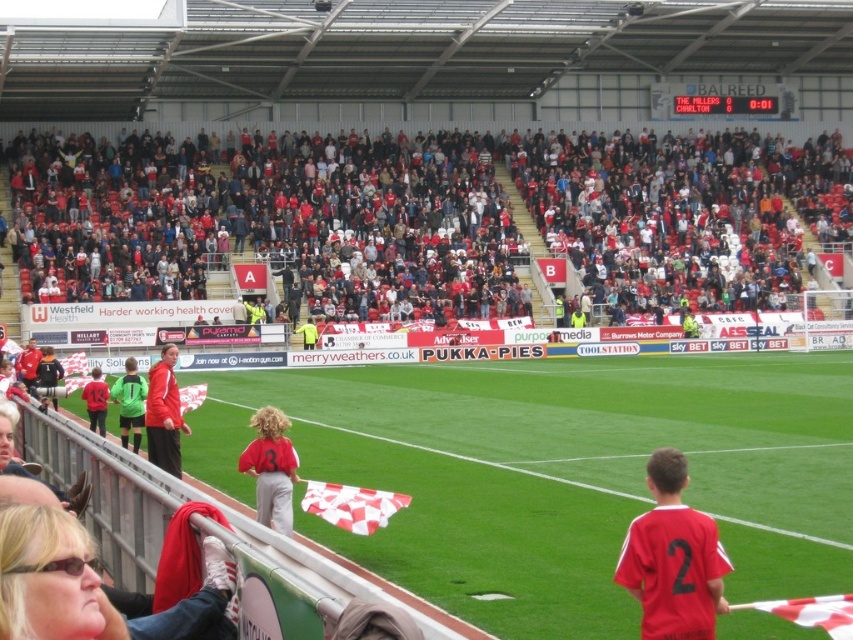
Which is behind, point (666, 490) or point (126, 388)?

Positioned behind is point (126, 388).

Who is more distant from viewer, (647, 560) or (120, 403)?

Point (120, 403)

At what (x,y) coordinates should I click in order to perform the action: click on red jersey at center. Please return your answer as a coordinate pair (x, y). The image size is (853, 640). Looking at the image, I should click on (672, 557).

Is red jacket at center shorter than matte red shirt at left?

No, red jacket at center is not shorter than matte red shirt at left.

Describe the element at coordinates (164, 413) in the screenshot. The width and height of the screenshot is (853, 640). I see `red jacket at center` at that location.

Identify the location of red jacket at center. (164, 413).

Is green jersey at center thinner than matte red shirt at lower left?

Incorrect, green jersey at center's width is not less than matte red shirt at lower left's.

Is point (134, 385) closer to camera compared to point (35, 346)?

Yes, it is in front of point (35, 346).

I want to click on green jersey at center, so click(x=131, y=403).